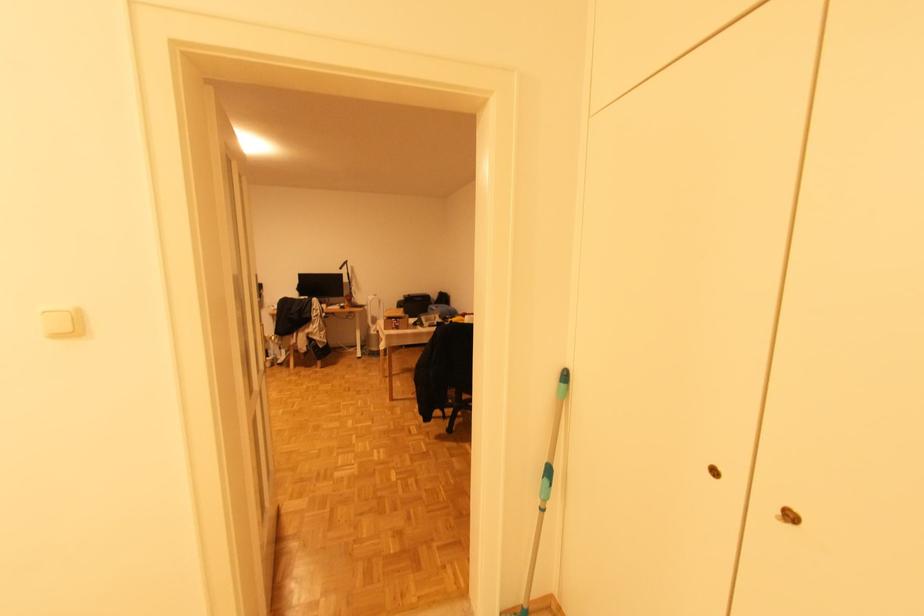
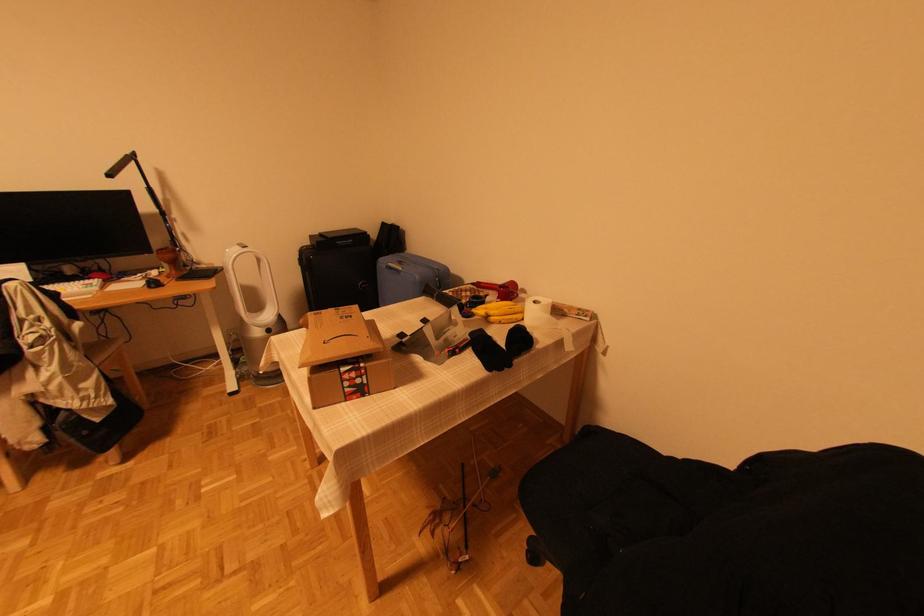
Locate, in the second image, the point that corresponds to (345,308) in the first image.

(156, 284)